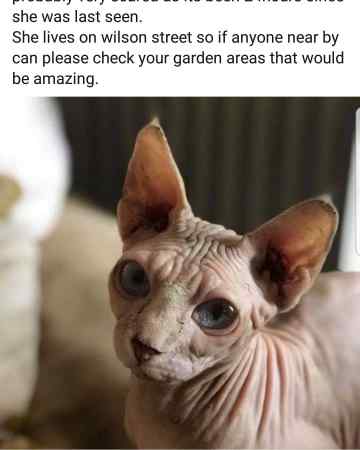
At what (x,y) coordinates should I click in order to perform the action: click on curtain behind cat. Please return your answer as a coordinate pair (x, y). The width and height of the screenshot is (360, 450). Looking at the image, I should click on (242, 190).